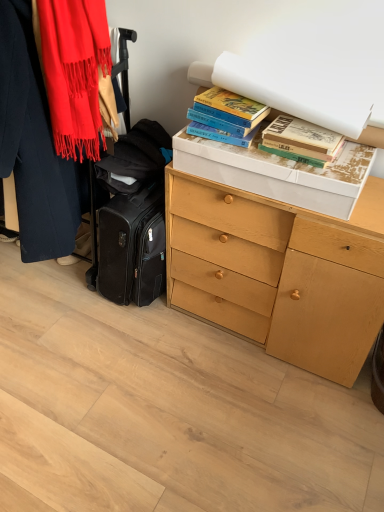
Question: Considering the positions of light wood chest of drawers at center and matte red scarf at left in the image, is light wood chest of drawers at center wider or thinner than matte red scarf at left?

Choices:
 (A) wide
 (B) thin

Answer: (A)

Question: From a real-world perspective, is light wood chest of drawers at center physically located above or below matte red scarf at left?

Choices:
 (A) below
 (B) above

Answer: (A)

Question: Which is farther from the hardcover books at upper right, the 2th book in the right-to-left sequence?

Choices:
 (A) matte red scarf at left
 (B) light wood chest of drawers at center
 (C) hardcover books at upper right, the first book viewed from the right

Answer: (B)

Question: Which object is the closest to the matte red scarf at left?

Choices:
 (A) hardcover books at upper right, the second book when ordered from left to right
 (B) light wood chest of drawers at center
 (C) hardcover books at upper right, arranged as the 1th book when viewed from the left

Answer: (C)